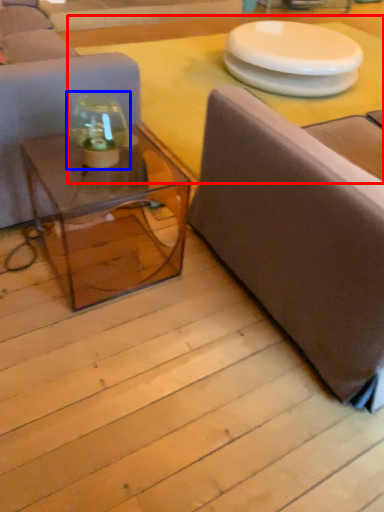
Question: Which object appears farthest to the camera in this image, table top (highlighted by a red box) or glass vase (highlighted by a blue box)?

Choices:
 (A) table top
 (B) glass vase

Answer: (A)